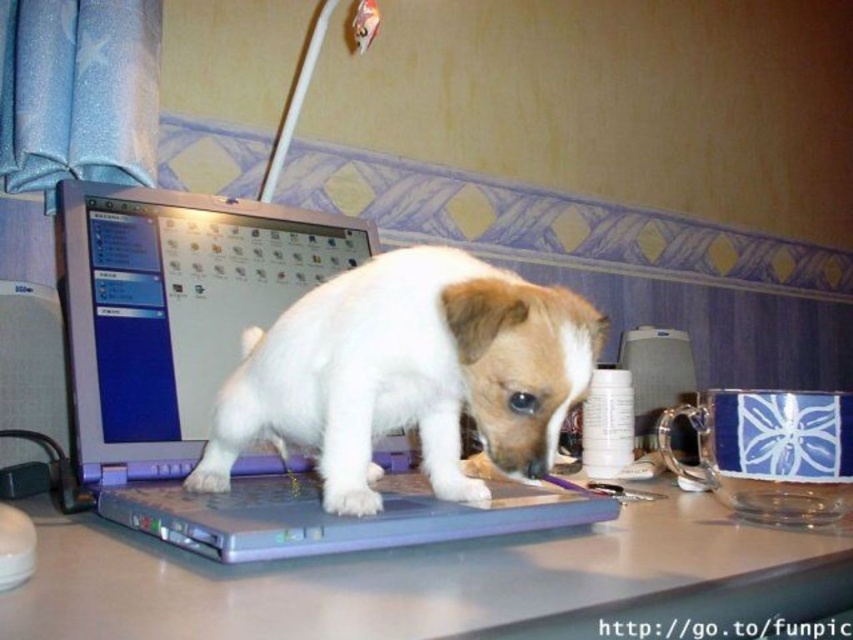
You are trying to take a photo of the white fur dog at center and the satin silver laptop at center from a position behind the desk. Which object will appear larger in the photo?

The white fur dog at center will appear larger in the photo because it is closer to the viewer than the satin silver laptop at center.

You are trying to determine which laptop is taller between the gray plastic laptop at center and the satin silver laptop at center. Based on the scene description, which one is taller?

The satin silver laptop at center is taller than the gray plastic laptop at center according to the description.